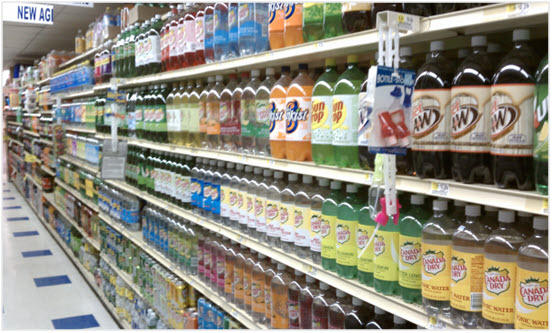
You are a GUI agent. You are given a task and a screenshot of the screen. Output one action in this format:
    pyautogui.click(x=<x>, y=<y>)
    Task: Click on the blue tiles
    Image resolution: width=552 pixels, height=333 pixels.
    Given the screenshot: What is the action you would take?
    pyautogui.click(x=82, y=322), pyautogui.click(x=52, y=279), pyautogui.click(x=35, y=250), pyautogui.click(x=25, y=232), pyautogui.click(x=18, y=217), pyautogui.click(x=14, y=206), pyautogui.click(x=9, y=198), pyautogui.click(x=8, y=188)